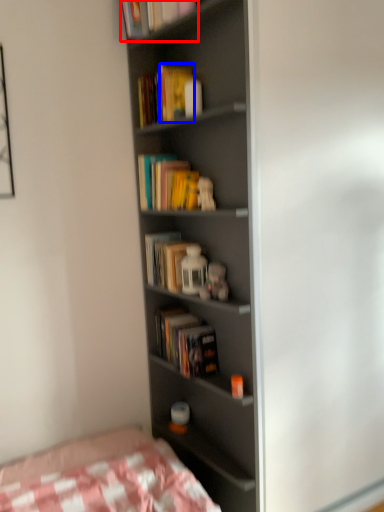
Question: Among these objects, which one is nearest to the camera, book (highlighted by a red box) or paperback book (highlighted by a blue box)?

Choices:
 (A) book
 (B) paperback book

Answer: (B)